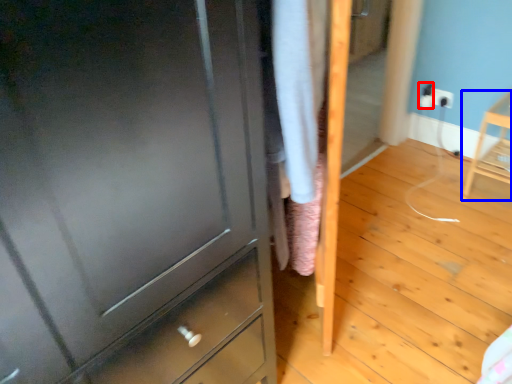
Question: Which of the following is the farthest to the observer, electric outlet (highlighted by a red box) or furniture (highlighted by a blue box)?

Choices:
 (A) electric outlet
 (B) furniture

Answer: (A)